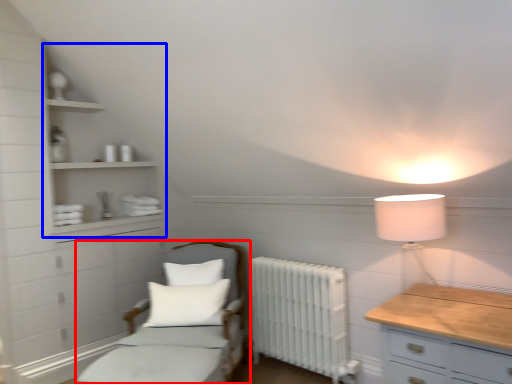
Question: Which object is closer to the camera taking this photo, furniture (highlighted by a red box) or cabinet (highlighted by a blue box)?

Choices:
 (A) furniture
 (B) cabinet

Answer: (A)